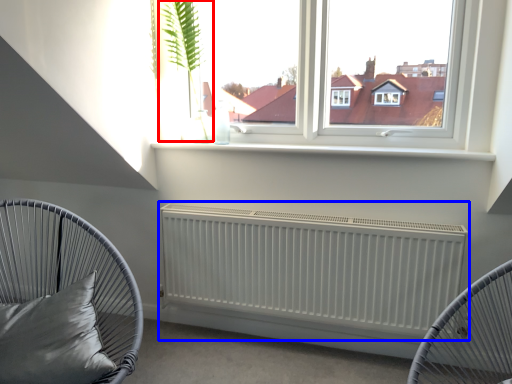
Question: Among these objects, which one is farthest to the camera, plant (highlighted by a red box) or radiator (highlighted by a blue box)?

Choices:
 (A) plant
 (B) radiator

Answer: (A)